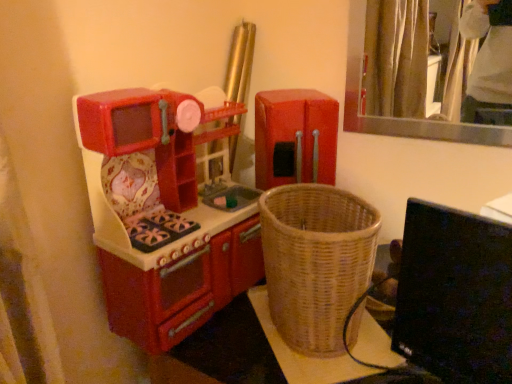
Question: Considering the relative positions of woven wicker basket at lower right and black glossy computer monitor at lower right in the image provided, is woven wicker basket at lower right to the left of black glossy computer monitor at lower right from the viewer's perspective?

Choices:
 (A) yes
 (B) no

Answer: (A)

Question: From a real-world perspective, is woven wicker basket at lower right positioned under black glossy computer monitor at lower right based on gravity?

Choices:
 (A) no
 (B) yes

Answer: (B)

Question: From the image's perspective, is woven wicker basket at lower right over black glossy computer monitor at lower right?

Choices:
 (A) no
 (B) yes

Answer: (A)

Question: Is woven wicker basket at lower right surrounding black glossy computer monitor at lower right?

Choices:
 (A) yes
 (B) no

Answer: (B)

Question: Is woven wicker basket at lower right outside of black glossy computer monitor at lower right?

Choices:
 (A) no
 (B) yes

Answer: (B)

Question: Is woven wicker basket at lower right oriented away from black glossy computer monitor at lower right?

Choices:
 (A) yes
 (B) no

Answer: (B)

Question: Is woven wicker basket at lower right outside of matte plastic toy kitchen at left, which ranks as the second appliance in right-to-left order?

Choices:
 (A) yes
 (B) no

Answer: (A)

Question: Can you confirm if woven wicker basket at lower right is thinner than matte plastic toy kitchen at left, the first appliance when ordered from left to right?

Choices:
 (A) no
 (B) yes

Answer: (A)

Question: From the image's perspective, does woven wicker basket at lower right appear higher than matte plastic toy kitchen at left, the first appliance when ordered from left to right?

Choices:
 (A) no
 (B) yes

Answer: (A)

Question: Can you confirm if woven wicker basket at lower right is smaller than matte plastic toy kitchen at left, the first appliance when ordered from left to right?

Choices:
 (A) yes
 (B) no

Answer: (A)

Question: Does woven wicker basket at lower right come behind matte plastic toy kitchen at left, the first appliance when ordered from left to right?

Choices:
 (A) no
 (B) yes

Answer: (B)

Question: Is woven wicker basket at lower right surrounding matte plastic toy kitchen at left, which ranks as the second appliance in right-to-left order?

Choices:
 (A) yes
 (B) no

Answer: (B)

Question: Is red plastic refrigerator at center, the second appliance in the left-to-right sequence, surrounded by black glossy computer monitor at lower right?

Choices:
 (A) no
 (B) yes

Answer: (A)